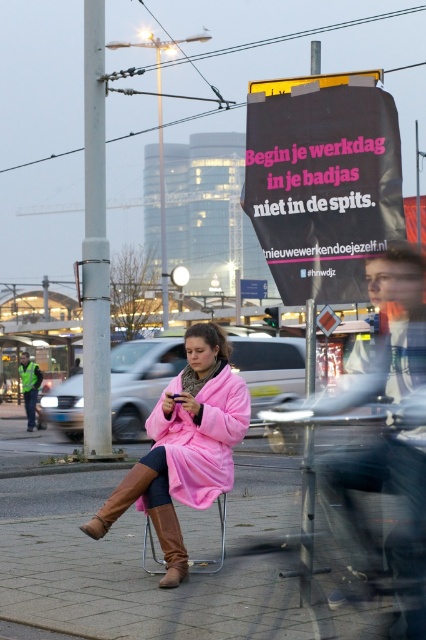
The image size is (426, 640). What are the coordinates of `black matte sign at upper center` in the screenshot? It's located at (322, 180).

Looking at this image, can you confirm if pink velvety coat at center is smaller than brown suede boot at lower center?

No, pink velvety coat at center is not smaller than brown suede boot at lower center.

The image size is (426, 640). What do you see at coordinates (184, 448) in the screenshot?
I see `pink velvety coat at center` at bounding box center [184, 448].

What do you see at coordinates (184, 448) in the screenshot?
I see `pink velvety coat at center` at bounding box center [184, 448].

Identify the location of pink velvety coat at center. This screenshot has height=640, width=426. (184, 448).

Does black matte sign at upper center appear on the right side of pink velvety coat at center?

Yes, black matte sign at upper center is to the right of pink velvety coat at center.

The image size is (426, 640). What do you see at coordinates (322, 180) in the screenshot?
I see `black matte sign at upper center` at bounding box center [322, 180].

The image size is (426, 640). Identify the location of black matte sign at upper center. (322, 180).